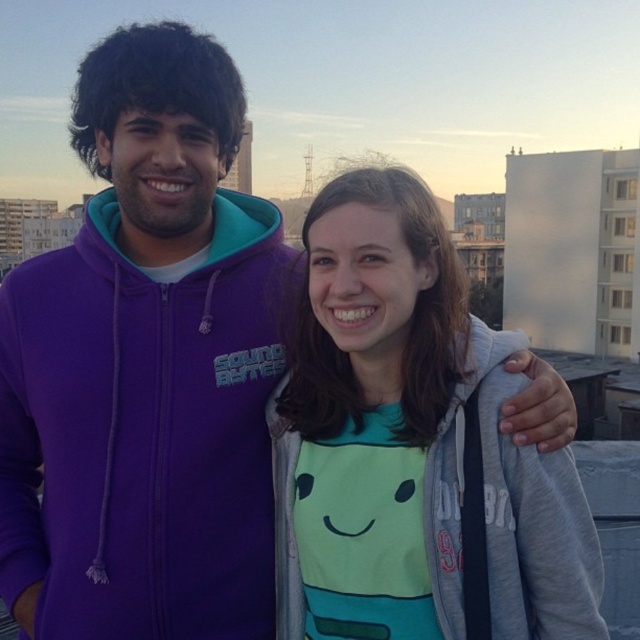
You are a photographer trying to position two markers in a photo editing software. The markers are placed at point (109, 204) and point (428, 376). According to the scene, which marker is closer to the camera?

Point (109, 204) is further to the viewer than point (428, 376), so the marker at point (428, 376) is closer to the camera.

Please provide the 2D coordinates of the purple fleece jacket at center in the image.

The purple fleece jacket at center is located at coordinates (145, 365).